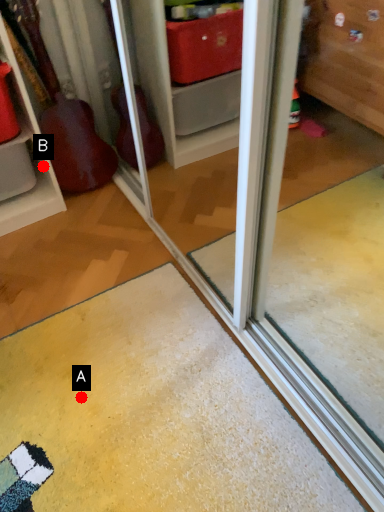
Question: Two points are circled on the image, labeled by A and B beside each circle. Which of the following is the farthest from the observer?

Choices:
 (A) A is further
 (B) B is further

Answer: (B)